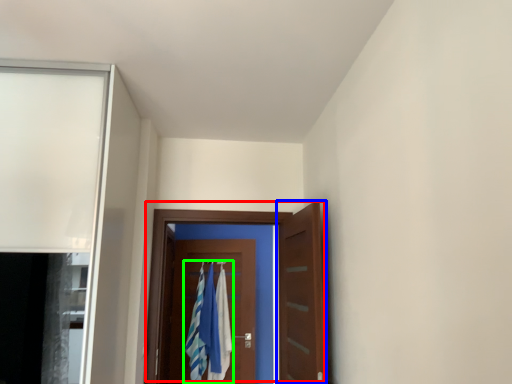
Question: Considering the real-world distances, which object is farthest from door (highlighted by a red box)? door (highlighted by a blue box) or laundry (highlighted by a green box)?

Choices:
 (A) door
 (B) laundry

Answer: (B)